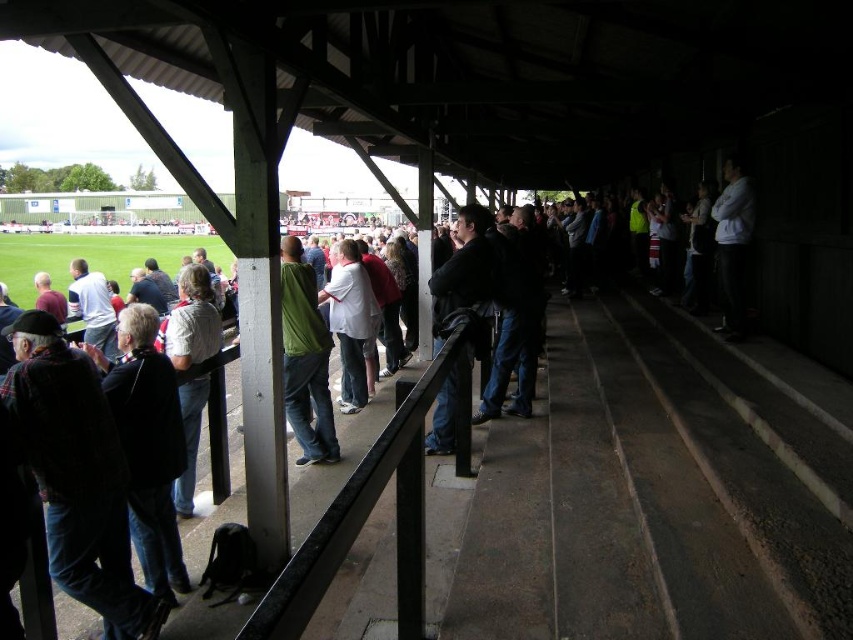
Does green matte shirt at center have a smaller size compared to white matte shirt at center?

Correct, green matte shirt at center occupies less space than white matte shirt at center.

You are a GUI agent. You are given a task and a screenshot of the screen. Output one action in this format:
    pyautogui.click(x=<x>, y=<y>)
    Task: Click on the green matte shirt at center
    
    Given the screenshot: What is the action you would take?
    pyautogui.click(x=305, y=358)

Is point (325, 435) positioned before point (357, 406)?

Yes, it is.

The height and width of the screenshot is (640, 853). Identify the location of green matte shirt at center. (305, 358).

Looking at this image, how much distance is there between light gray shirt at center and black leather jacket at center?

light gray shirt at center is 7.56 feet from black leather jacket at center.

Which is behind, point (196, 396) or point (463, 243)?

Positioned behind is point (196, 396).

At what (x,y) coordinates should I click in order to perform the action: click on light gray shirt at center. Please return your answer as a coordinate pair (x, y). Looking at the image, I should click on (190, 365).

Can you confirm if light gray shirt at center is shorter than white matte jacket at upper right?

No.

Can you confirm if light gray shirt at center is bigger than white matte jacket at upper right?

Indeed, light gray shirt at center has a larger size compared to white matte jacket at upper right.

Describe the element at coordinates (190, 365) in the screenshot. I see `light gray shirt at center` at that location.

Image resolution: width=853 pixels, height=640 pixels. What are the coordinates of `light gray shirt at center` in the screenshot? It's located at (190, 365).